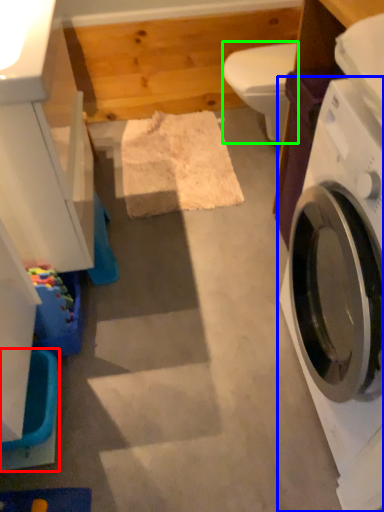
Question: Which object is the closest to the washer (highlighted by a red box)? Choose among these: washing machine (highlighted by a blue box) or toilet bowl (highlighted by a green box).

Choices:
 (A) washing machine
 (B) toilet bowl

Answer: (A)